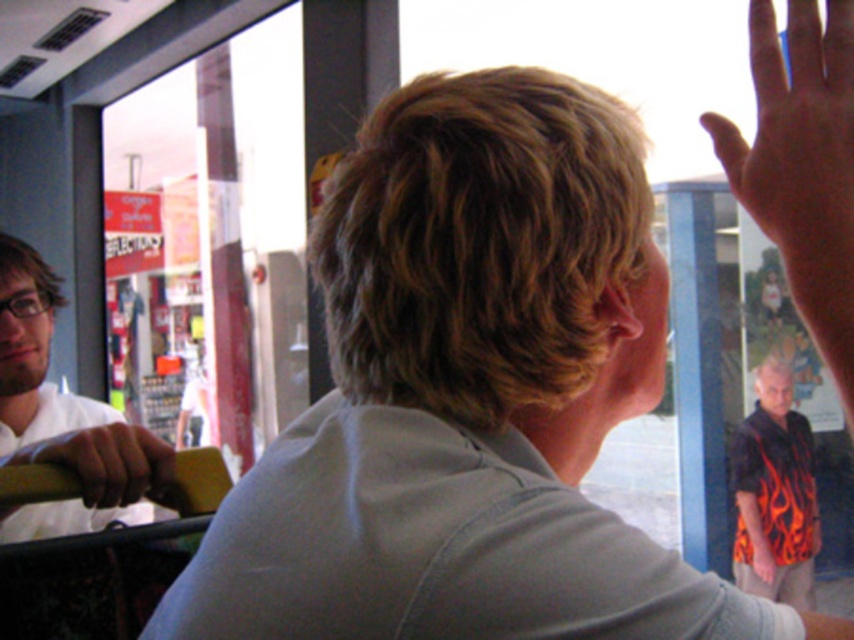
Is skinny flesh at upper right positioned before white matte shirt at left?

Yes, it is in front of white matte shirt at left.

Can you confirm if skinny flesh at upper right is shorter than white matte shirt at left?

Yes.

Does point (812, 264) come farther from viewer compared to point (0, 308)?

No, (812, 264) is closer to viewer.

This screenshot has width=854, height=640. I want to click on skinny flesh at upper right, so click(x=797, y=138).

Is skinny flesh at upper right closer to the viewer compared to wooden handle at lower left?

Yes, skinny flesh at upper right is in front of wooden handle at lower left.

Between point (823, 148) and point (121, 500), which one is positioned behind?

The point (121, 500) is more distant.

Does point (752, 22) come closer to viewer compared to point (108, 428)?

Yes.

You are a GUI agent. You are given a task and a screenshot of the screen. Output one action in this format:
    pyautogui.click(x=<x>, y=<y>)
    Task: Click on the skinny flesh at upper right
    The height and width of the screenshot is (640, 854).
    Given the screenshot: What is the action you would take?
    pyautogui.click(x=797, y=138)

Does point (4, 275) come farther from viewer compared to point (28, 456)?

That is True.

Who is lower down, white matte shirt at left or wooden handle at lower left?

wooden handle at lower left

Find the location of a particular element. The height and width of the screenshot is (640, 854). white matte shirt at left is located at coordinates (62, 417).